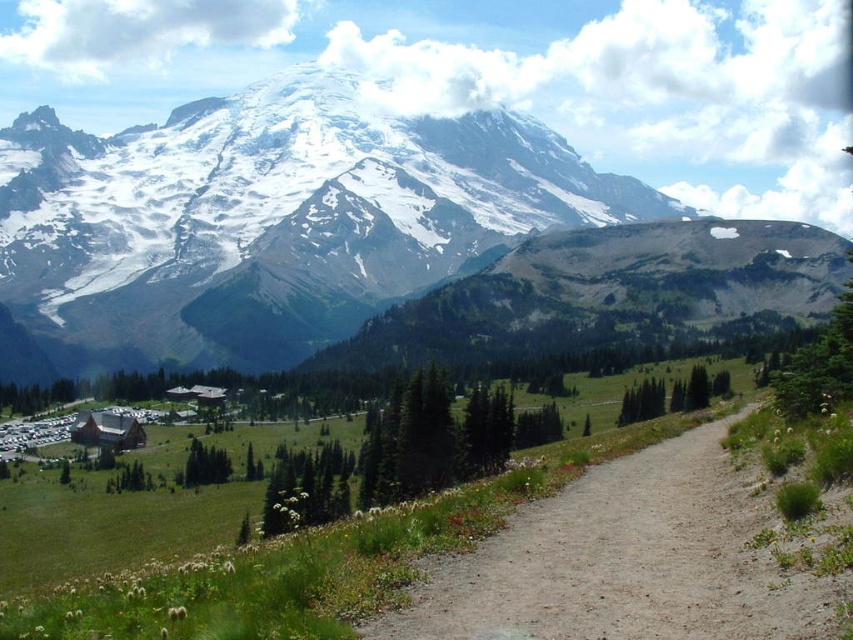
Can you confirm if snowy granite mountain range at upper center is thinner than dirt/gravel path at center?

Incorrect, snowy granite mountain range at upper center's width is not less than dirt/gravel path at center's.

Can you confirm if snowy granite mountain range at upper center is shorter than dirt/gravel path at center?

Incorrect, snowy granite mountain range at upper center's height does not fall short of dirt/gravel path at center's.

What do you see at coordinates (268, 220) in the screenshot? I see `snowy granite mountain range at upper center` at bounding box center [268, 220].

You are a GUI agent. You are given a task and a screenshot of the screen. Output one action in this format:
    pyautogui.click(x=<x>, y=<y>)
    Task: Click on the snowy granite mountain range at upper center
    The height and width of the screenshot is (640, 853).
    Given the screenshot: What is the action you would take?
    pyautogui.click(x=268, y=220)